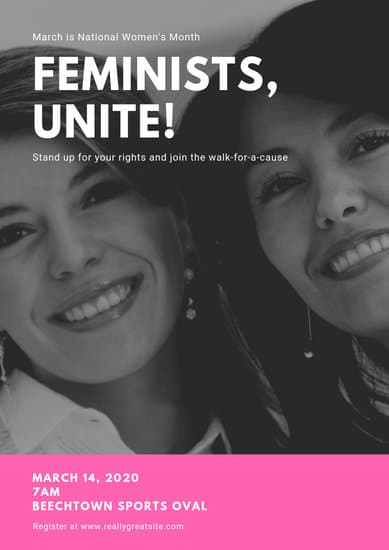
Where is `1 black and white photo`? 1 black and white photo is located at coordinates (251, 316).